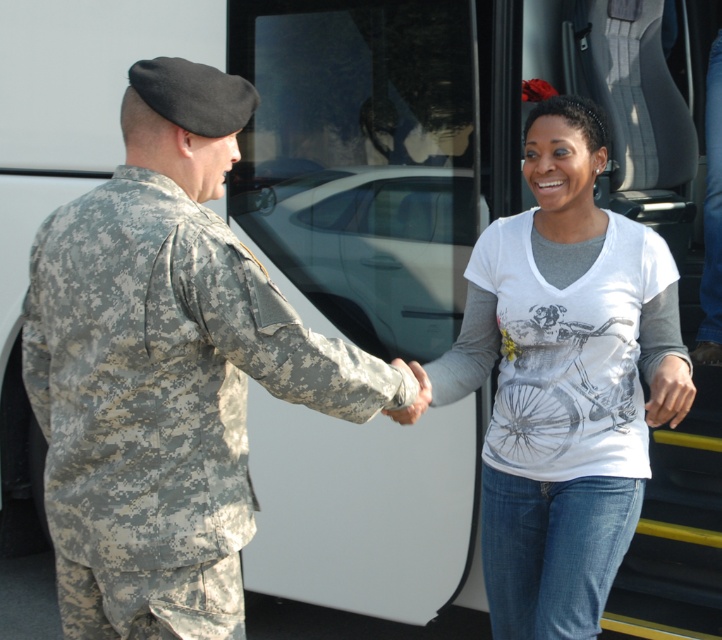
Question: Is camouflage uniform at left wider than white printed shirt at center?

Choices:
 (A) no
 (B) yes

Answer: (B)

Question: Which point is closer to the camera?

Choices:
 (A) camouflage uniform at left
 (B) white printed shirt at center

Answer: (A)

Question: Can you confirm if camouflage uniform at left is bigger than white printed shirt at center?

Choices:
 (A) no
 (B) yes

Answer: (B)

Question: Which point is farther to the camera?

Choices:
 (A) (108, 355)
 (B) (591, 484)

Answer: (B)

Question: Can you confirm if camouflage uniform at left is smaller than white printed shirt at center?

Choices:
 (A) no
 (B) yes

Answer: (A)

Question: Which of the following is the farthest from the observer?

Choices:
 (A) (187, 540)
 (B) (552, 474)

Answer: (B)